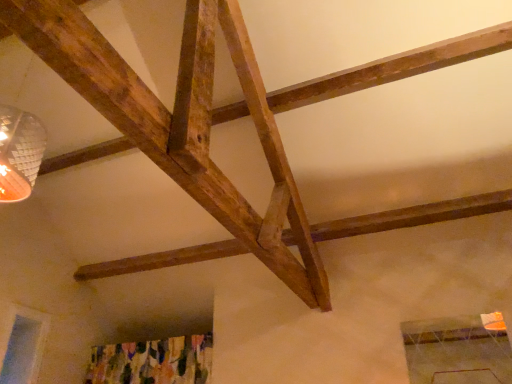
Question: Should I look upward or downward to see clear glass window at lower left?

Choices:
 (A) up
 (B) down

Answer: (B)